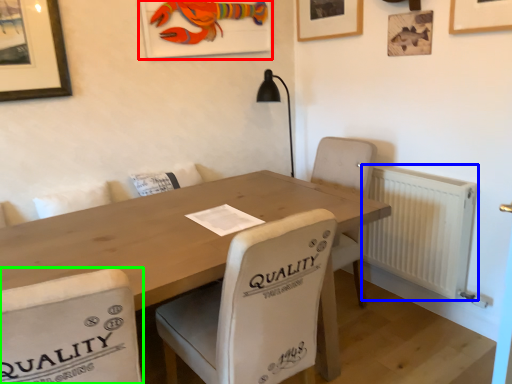
Question: Based on their relative distances, which object is nearer to picture frame (highlighted by a red box)? Choose from radiator (highlighted by a blue box) and chair (highlighted by a green box).

Choices:
 (A) radiator
 (B) chair

Answer: (A)